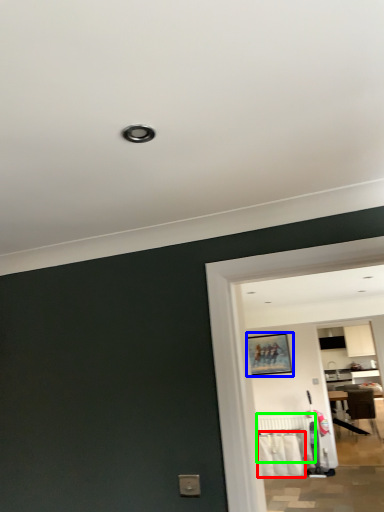
Question: Based on their relative distances, which object is farther from laundry (highlighted by a red box)? Choose from picture frame (highlighted by a blue box) and radiator (highlighted by a green box).

Choices:
 (A) picture frame
 (B) radiator

Answer: (A)